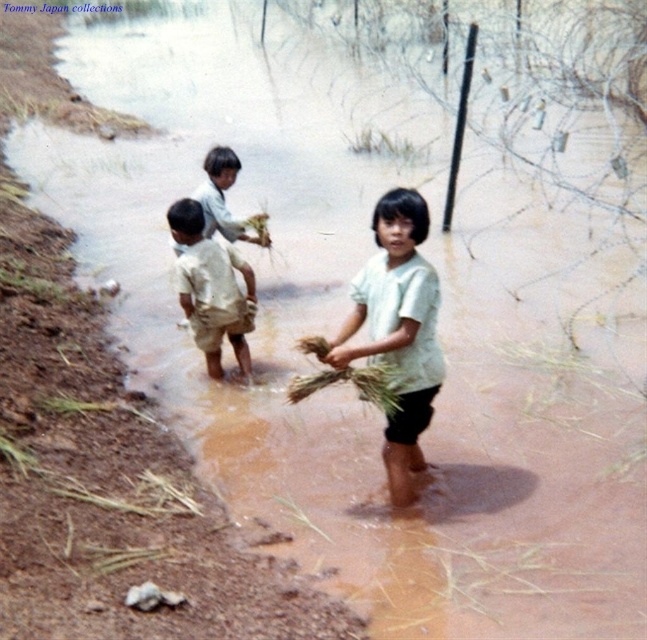
Question: Is light beige cotton shirt at center bigger than light beige shorts at center?

Choices:
 (A) yes
 (B) no

Answer: (A)

Question: Among these points, which one is nearest to the camera?

Choices:
 (A) (388, 240)
 (B) (184, 230)

Answer: (A)

Question: Is light beige cotton shirt at center positioned before light beige shorts at center?

Choices:
 (A) yes
 (B) no

Answer: (A)

Question: Which object is farther from the camera taking this photo?

Choices:
 (A) light beige shorts at center
 (B) light beige cotton shirt at center

Answer: (A)

Question: Is light beige cotton shirt at center bigger than light beige shorts at center?

Choices:
 (A) yes
 (B) no

Answer: (A)